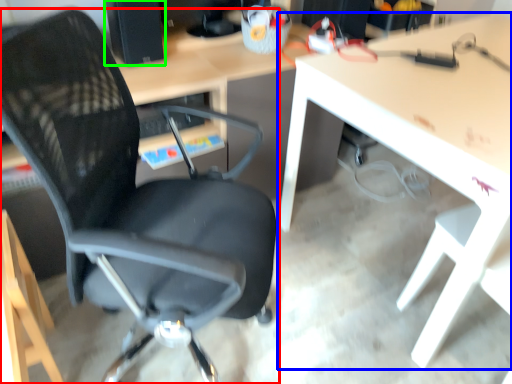
Question: Which object is positioned closest to chair (highlighted by a red box)? Select from table (highlighted by a blue box) and desktop computer (highlighted by a green box).

Choices:
 (A) table
 (B) desktop computer

Answer: (A)